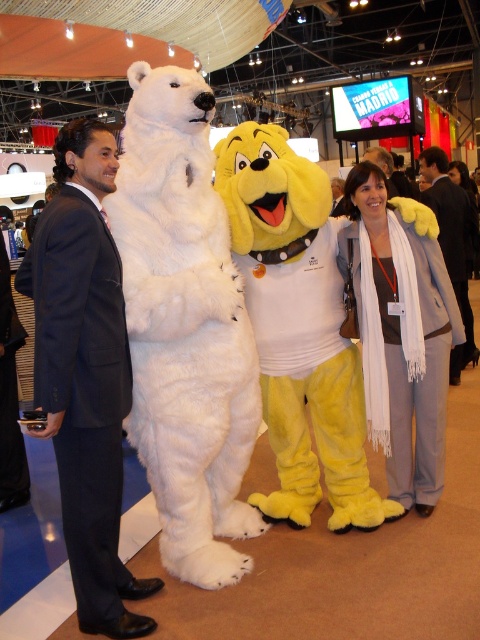
Question: Does white furry bear at left appear over white scarf at center?

Choices:
 (A) no
 (B) yes

Answer: (B)

Question: Among these points, which one is farthest from the camera?

Choices:
 (A) (119, 493)
 (B) (432, 211)
 (C) (184, 212)
 (D) (375, 412)

Answer: (B)

Question: Can you confirm if white furry bear at left is positioned to the left of dark suit at center?

Choices:
 (A) yes
 (B) no

Answer: (A)

Question: Among these objects, which one is nearest to the camera?

Choices:
 (A) dark suit at center
 (B) white furry bear at left
 (C) white scarf at center
 (D) dark blue suit at left

Answer: (D)

Question: Which of these objects is positioned farthest from the dark suit at center?

Choices:
 (A) white scarf at center
 (B) white furry bear at left

Answer: (B)

Question: Can you confirm if white furry bear at left is bigger than white scarf at center?

Choices:
 (A) yes
 (B) no

Answer: (A)